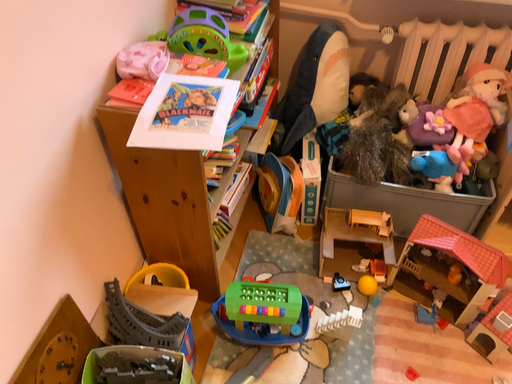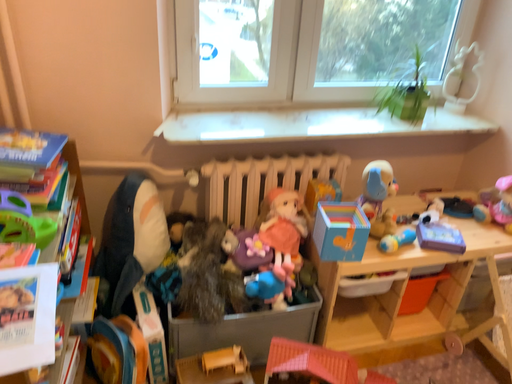
Question: How did the camera likely rotate when shooting the video?

Choices:
 (A) rotated left
 (B) rotated right

Answer: (B)